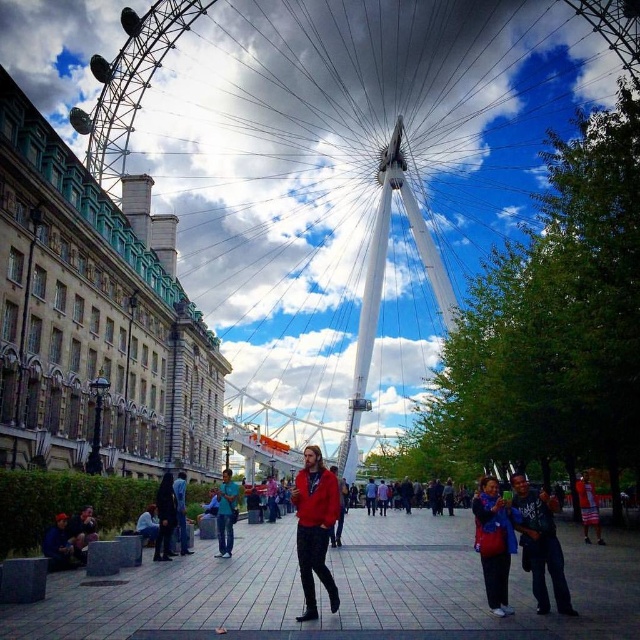
You are a photographer trying to capture a candid shot of the two people at the lower right corner of the image. The scene includes a dark blue jeans at lower right and a red fabric shorts at lower right. Which of the two occupies more space in the photo?

The red fabric shorts at lower right occupies more space than the dark blue jeans at lower right.

You are standing at the point labeled as point (129, 83) in the image. What object is located exactly at that point?

The point (129, 83) corresponds to the white metallic ferris wheel at center.

You are standing at the center of the square and want to find the red matte jacket at center. According to the coordinates provided, in which direction should you look to locate it?

The red matte jacket at center is located at coordinates point (314,528). Since the coordinate system is normalized, with the origin at the bottom left corner, 0.825 on the x axis means it is 82.5 percent from the left edge towards the right edge, and 0.492 on the y axis means it is 49.2 percent from the bottom edge towards the top edge. Therefore, you should look towards the right and slightly up from the center to locate it.